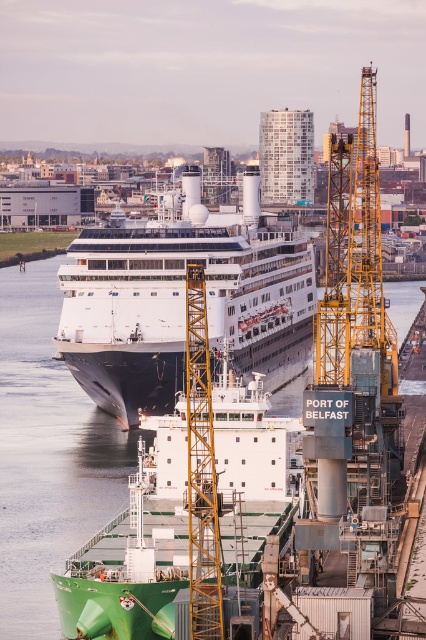
Question: Is white glossy cruise ship at center smaller than yellow metallic crane at right?

Choices:
 (A) no
 (B) yes

Answer: (A)

Question: Which object appears closest to the camera in this image?

Choices:
 (A) clear water at center
 (B) white glossy cruise ship at center

Answer: (A)

Question: Based on their relative distances, which object is farther from the clear water at center?

Choices:
 (A) yellow metallic crane at right
 (B) white glossy cruise ship at center

Answer: (A)

Question: Is clear water at center bigger than yellow metallic crane at right?

Choices:
 (A) yes
 (B) no

Answer: (A)

Question: Which point is farther from the camera taking this photo?

Choices:
 (A) (114, 497)
 (B) (140, 378)
 (C) (351, 134)

Answer: (B)

Question: Can you confirm if white glossy cruise ship at center is positioned to the left of clear water at center?

Choices:
 (A) yes
 (B) no

Answer: (B)